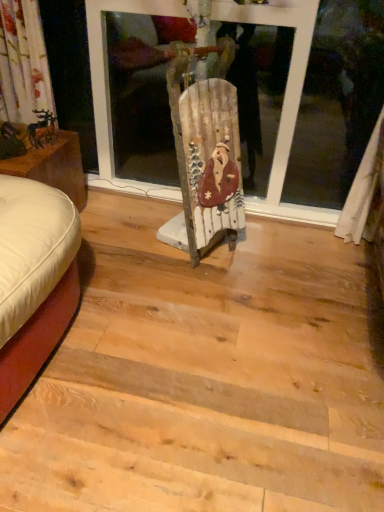
Question: Does point (66, 186) appear closer or farther from the camera than point (49, 116)?

Choices:
 (A) farther
 (B) closer

Answer: (B)

Question: Relative to metallic gold reindeer at left, is white leather ottoman at left in front or behind?

Choices:
 (A) front
 (B) behind

Answer: (A)

Question: From the image's perspective, is white leather ottoman at left positioned above or below metallic gold reindeer at left?

Choices:
 (A) above
 (B) below

Answer: (B)

Question: In terms of size, does metallic gold reindeer at left appear bigger or smaller than white leather ottoman at left?

Choices:
 (A) small
 (B) big

Answer: (A)

Question: From the image's perspective, is metallic gold reindeer at left positioned above or below white leather ottoman at left?

Choices:
 (A) above
 (B) below

Answer: (A)

Question: From a real-world perspective, is metallic gold reindeer at left positioned above or below white leather ottoman at left?

Choices:
 (A) below
 (B) above

Answer: (B)

Question: Is point [x=44, y=112] closer or farther from the camera than point [x=39, y=170]?

Choices:
 (A) closer
 (B) farther

Answer: (B)